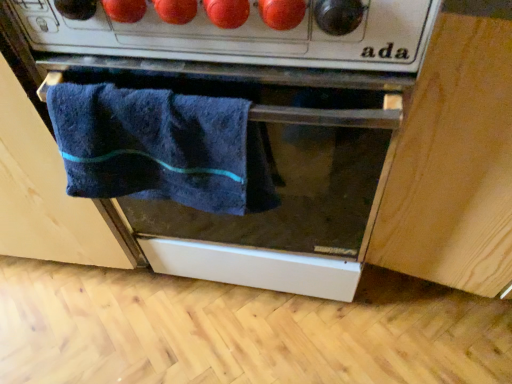
This screenshot has width=512, height=384. Describe the element at coordinates (50, 195) in the screenshot. I see `dark blue towel at center, which is the 2th cabinetry in right-to-left order` at that location.

Locate an element on the screen. navy blue towel at center is located at coordinates (161, 147).

Where is `cabinetry on the right of the dark blue towel at center, marked as the first cabinetry in a left-to-right arrangement`? The image size is (512, 384). cabinetry on the right of the dark blue towel at center, marked as the first cabinetry in a left-to-right arrangement is located at coordinates (454, 164).

From a real-world perspective, between light wood cabinet at lower right, the 1th cabinetry from the right, and dark blue towel at center, which is the 2th cabinetry in right-to-left order, who is vertically higher?

In real-world perspective, light wood cabinet at lower right, the 1th cabinetry from the right, is above.

From the picture: From a real-world perspective, who is located lower, navy blue towel at center or matte black oven at center?

From a 3D spatial view, matte black oven at center is below.

Is navy blue towel at center positioned beyond the bounds of matte black oven at center?

Actually, navy blue towel at center is within matte black oven at center.

Image resolution: width=512 pixels, height=384 pixels. I want to click on oven beneath the navy blue towel at center (from a real-world perspective), so click(250, 119).

Consider the image. Looking at their sizes, would you say navy blue towel at center is wider or thinner than matte black oven at center?

Considering their sizes, navy blue towel at center looks slimmer than matte black oven at center.

Is light wood cabinet at lower right, the second cabinetry in the left-to-right sequence, aimed at navy blue towel at center?

No.

Can you confirm if light wood cabinet at lower right, the 1th cabinetry from the right, is smaller than navy blue towel at center?

Incorrect, light wood cabinet at lower right, the 1th cabinetry from the right, is not smaller in size than navy blue towel at center.

Is point (497, 219) closer or farther from the camera than point (194, 163)?

Clearly, point (497, 219) is more distant from the camera than point (194, 163).

In terms of height, does light wood cabinet at lower right, the 1th cabinetry from the right, look taller or shorter compared to navy blue towel at center?

light wood cabinet at lower right, the 1th cabinetry from the right, is taller than navy blue towel at center.

Find the location of `oven on the left side of light wood cabinet at lower right, the 1th cabinetry from the right`. oven on the left side of light wood cabinet at lower right, the 1th cabinetry from the right is located at coordinates (250, 119).

Considering the sizes of matte black oven at center and light wood cabinet at lower right, the second cabinetry in the left-to-right sequence, in the image, is matte black oven at center wider or thinner than light wood cabinet at lower right, the second cabinetry in the left-to-right sequence,?

Clearly, matte black oven at center has more width compared to light wood cabinet at lower right, the second cabinetry in the left-to-right sequence.

The width and height of the screenshot is (512, 384). I want to click on oven located behind the light wood cabinet at lower right, the second cabinetry in the left-to-right sequence, so click(x=250, y=119).

Is point (474, 240) positioned before point (394, 71)?

No, (474, 240) is behind (394, 71).

From a real-world perspective, is light wood cabinet at lower right, the 1th cabinetry from the right, physically above matte black oven at center?

Yes.

Would you say light wood cabinet at lower right, the second cabinetry in the left-to-right sequence, is to the left or to the right of matte black oven at center in the picture?

In the image, light wood cabinet at lower right, the second cabinetry in the left-to-right sequence, appears on the right side of matte black oven at center.

From a real-world perspective, between navy blue towel at center and dark blue towel at center, marked as the first cabinetry in a left-to-right arrangement, who is vertically higher?

navy blue towel at center, from a real-world perspective.

Considering the sizes of objects navy blue towel at center and dark blue towel at center, marked as the first cabinetry in a left-to-right arrangement, in the image provided, who is thinner, navy blue towel at center or dark blue towel at center, marked as the first cabinetry in a left-to-right arrangement,?

navy blue towel at center.

Are navy blue towel at center and dark blue towel at center, which is the 2th cabinetry in right-to-left order, located far from each other?

That's not correct — navy blue towel at center is a little close to dark blue towel at center, which is the 2th cabinetry in right-to-left order.

Between point (153, 133) and point (467, 200), which one is positioned in front?

Positioned in front is point (153, 133).

Which is more to the right, navy blue towel at center or light wood cabinet at lower right, the second cabinetry in the left-to-right sequence?

From the viewer's perspective, light wood cabinet at lower right, the second cabinetry in the left-to-right sequence, appears more on the right side.

What's the angular difference between navy blue towel at center and light wood cabinet at lower right, the second cabinetry in the left-to-right sequence,'s facing directions?

There is a 1.74-degree angle between the facing directions of navy blue towel at center and light wood cabinet at lower right, the second cabinetry in the left-to-right sequence.

Would you say navy blue towel at center is a long distance from light wood cabinet at lower right, the 1th cabinetry from the right?

No.

Where is `cabinetry below the dark blue towel at center, which is the 2th cabinetry in right-to-left order (from the image's perspective)`? The height and width of the screenshot is (384, 512). cabinetry below the dark blue towel at center, which is the 2th cabinetry in right-to-left order (from the image's perspective) is located at coordinates (454, 164).

Image resolution: width=512 pixels, height=384 pixels. Find the location of `oven in front of the navy blue towel at center`. oven in front of the navy blue towel at center is located at coordinates (250, 119).

From the picture: Based on their spatial positions, is light wood cabinet at lower right, the 1th cabinetry from the right, or navy blue towel at center further from matte black oven at center?

light wood cabinet at lower right, the 1th cabinetry from the right, lies further to matte black oven at center than the other object.

Which object lies further to the anchor point matte black oven at center, navy blue towel at center or light wood cabinet at lower right, the 1th cabinetry from the right?

light wood cabinet at lower right, the 1th cabinetry from the right, is positioned further to the anchor matte black oven at center.

When comparing their distances from light wood cabinet at lower right, the 1th cabinetry from the right, does navy blue towel at center or matte black oven at center seem further?

navy blue towel at center is further to light wood cabinet at lower right, the 1th cabinetry from the right.

Considering their positions, is dark blue towel at center, which is the 2th cabinetry in right-to-left order, positioned further to light wood cabinet at lower right, the 1th cabinetry from the right, than navy blue towel at center?

dark blue towel at center, which is the 2th cabinetry in right-to-left order, is further to light wood cabinet at lower right, the 1th cabinetry from the right.

Based on the photo, estimate the real-world distances between objects in this image. Which object is closer to dark blue towel at center, marked as the first cabinetry in a left-to-right arrangement, navy blue towel at center or light wood cabinet at lower right, the second cabinetry in the left-to-right sequence?

The object closer to dark blue towel at center, marked as the first cabinetry in a left-to-right arrangement, is navy blue towel at center.

Which object lies nearer to the anchor point dark blue towel at center, marked as the first cabinetry in a left-to-right arrangement, light wood cabinet at lower right, the 1th cabinetry from the right, or navy blue towel at center?

navy blue towel at center.

Estimate the real-world distances between objects in this image. Which object is further from light wood cabinet at lower right, the second cabinetry in the left-to-right sequence, matte black oven at center or navy blue towel at center?

Among the two, navy blue towel at center is located further to light wood cabinet at lower right, the second cabinetry in the left-to-right sequence.

When comparing their distances from matte black oven at center, does dark blue towel at center, which is the 2th cabinetry in right-to-left order, or light wood cabinet at lower right, the second cabinetry in the left-to-right sequence, seem closer?

Based on the image, dark blue towel at center, which is the 2th cabinetry in right-to-left order, appears to be nearer to matte black oven at center.

Identify the location of towel between dark blue towel at center, marked as the first cabinetry in a left-to-right arrangement, and light wood cabinet at lower right, the 1th cabinetry from the right. (161, 147).

This screenshot has height=384, width=512. Find the location of `oven situated between dark blue towel at center, marked as the first cabinetry in a left-to-right arrangement, and light wood cabinet at lower right, the second cabinetry in the left-to-right sequence, from left to right`. oven situated between dark blue towel at center, marked as the first cabinetry in a left-to-right arrangement, and light wood cabinet at lower right, the second cabinetry in the left-to-right sequence, from left to right is located at coordinates (250, 119).

Where is `oven between navy blue towel at center and light wood cabinet at lower right, the 1th cabinetry from the right, from left to right`? The image size is (512, 384). oven between navy blue towel at center and light wood cabinet at lower right, the 1th cabinetry from the right, from left to right is located at coordinates [250, 119].

In order to click on towel between dark blue towel at center, which is the 2th cabinetry in right-to-left order, and matte black oven at center, in the horizontal direction in this screenshot , I will do `click(161, 147)`.